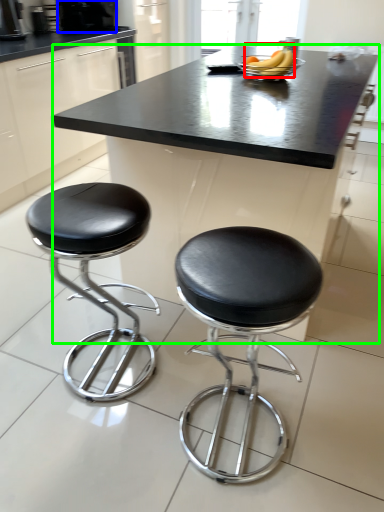
Question: Which object is positioned farthest from banana (highlighted by a red box)? Select from coffee machine (highlighted by a blue box) and table (highlighted by a green box).

Choices:
 (A) coffee machine
 (B) table

Answer: (A)